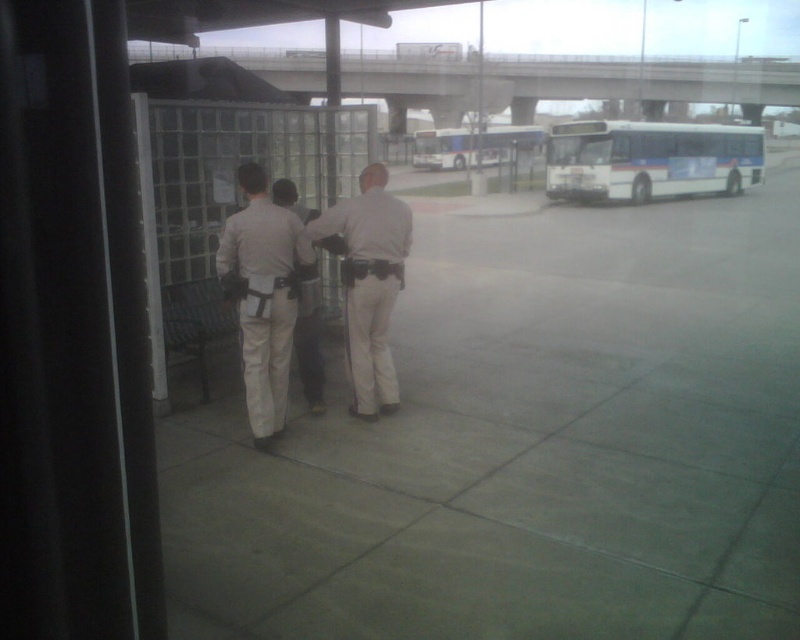
You are standing inside the building looking out the window. There are two points marked on the glass at coordinates point (254, 349) and point (304, 332). Which point is closer to your eyes?

Point (254, 349) is closer to the viewer than point (304, 332).

You are a security guard on duty and need to report the location of the tan uniform at center and the khaki uniform pants at center. Based on the scene, which one is positioned to the left?

The tan uniform at center is positioned to the left of the khaki uniform pants at center.

You are observing two officers through a window. Both are wearing khaki uniform pants at center and matte khaki pants at center. Which officer has clothing that appears taller?

The matte khaki pants at center has a greater height compared to the khaki uniform pants at center, so the officer wearing the matte khaki pants at center has clothing that appears taller.